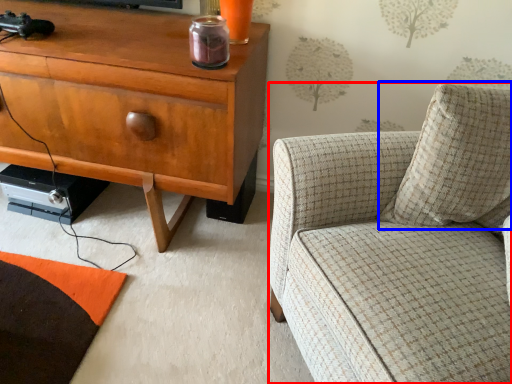
Question: Among these objects, which one is farthest to the camera, chair (highlighted by a red box) or pillow (highlighted by a blue box)?

Choices:
 (A) chair
 (B) pillow

Answer: (B)